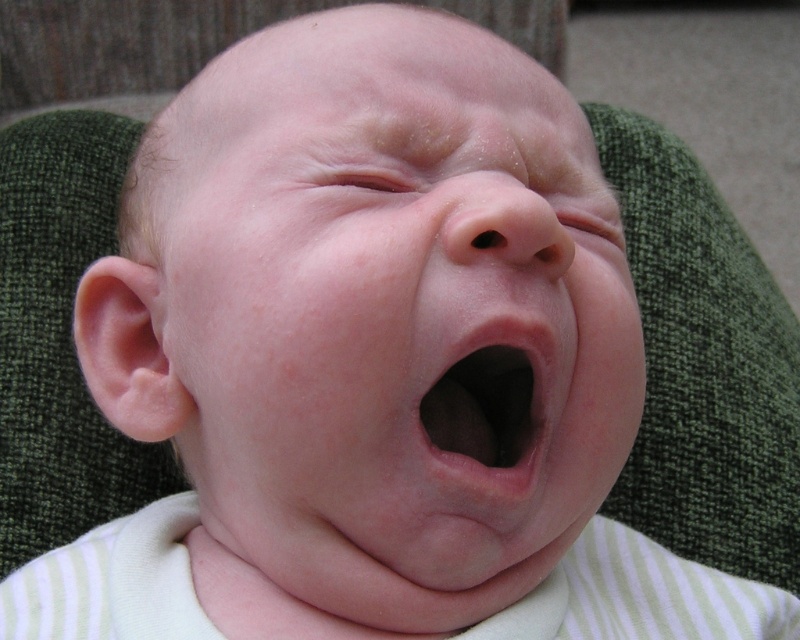
Consider the image. Can you confirm if pink smooth skin at center is taller than pink flesh/yellowish skin at center?

Indeed, pink smooth skin at center has a greater height compared to pink flesh/yellowish skin at center.

Does point (458, 250) come farther from viewer compared to point (530, 385)?

No, it is in front of (530, 385).

Identify the location of pink smooth skin at center. This screenshot has height=640, width=800. (394, 312).